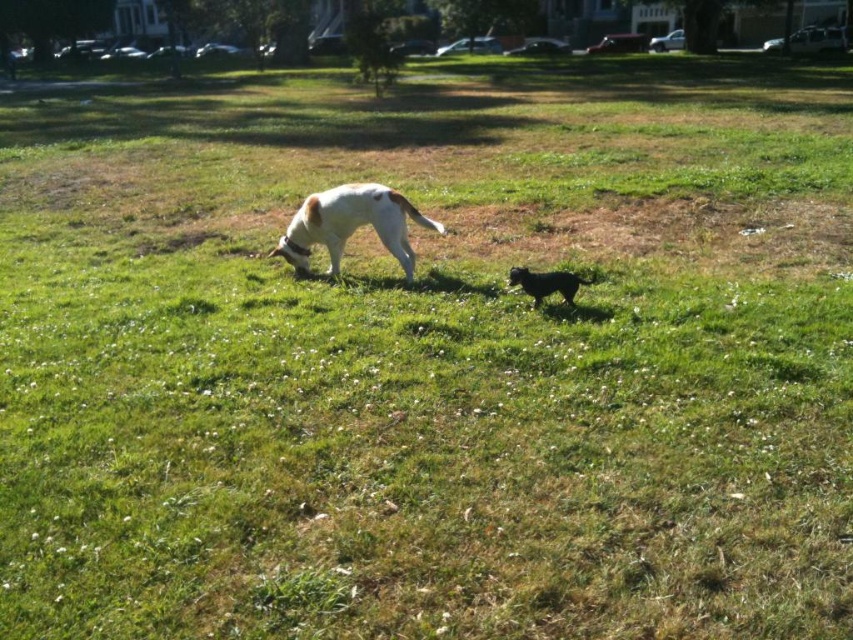
Is white matte dog at center behind shiny black dog at center?

Yes.

Describe the element at coordinates (351, 225) in the screenshot. I see `white matte dog at center` at that location.

You are a GUI agent. You are given a task and a screenshot of the screen. Output one action in this format:
    pyautogui.click(x=<x>, y=<y>)
    Task: Click on the white matte dog at center
    The width and height of the screenshot is (853, 640).
    Given the screenshot: What is the action you would take?
    pyautogui.click(x=351, y=225)